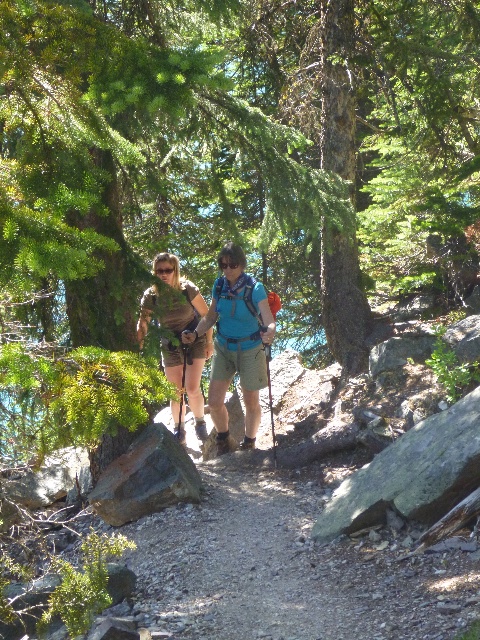
Question: Which point is closer to the camera?

Choices:
 (A) (112, 212)
 (B) (220, 292)

Answer: (A)

Question: Can you confirm if green leafy tree at center is positioned to the left of matte brown shorts at center?

Choices:
 (A) no
 (B) yes

Answer: (A)

Question: Which object appears farthest from the camera in this image?

Choices:
 (A) green leafy tree at center
 (B) blue fabric backpack at center

Answer: (B)

Question: Is green leafy tree at center bigger than blue fabric backpack at center?

Choices:
 (A) no
 (B) yes

Answer: (B)

Question: Which point is farther to the camera?

Choices:
 (A) matte brown shorts at center
 (B) blue fabric backpack at center

Answer: (B)

Question: Is green leafy tree at center above matte brown shorts at center?

Choices:
 (A) no
 (B) yes

Answer: (B)